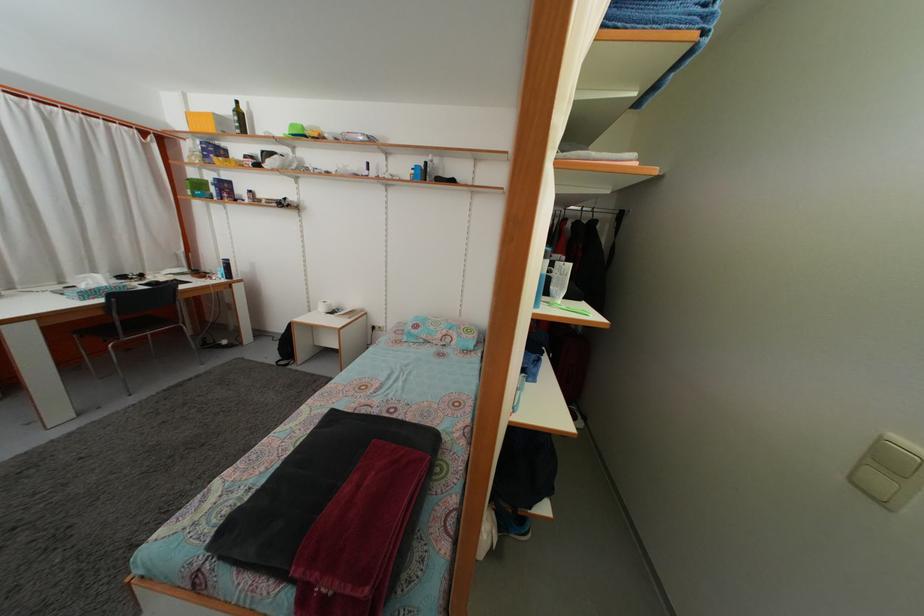
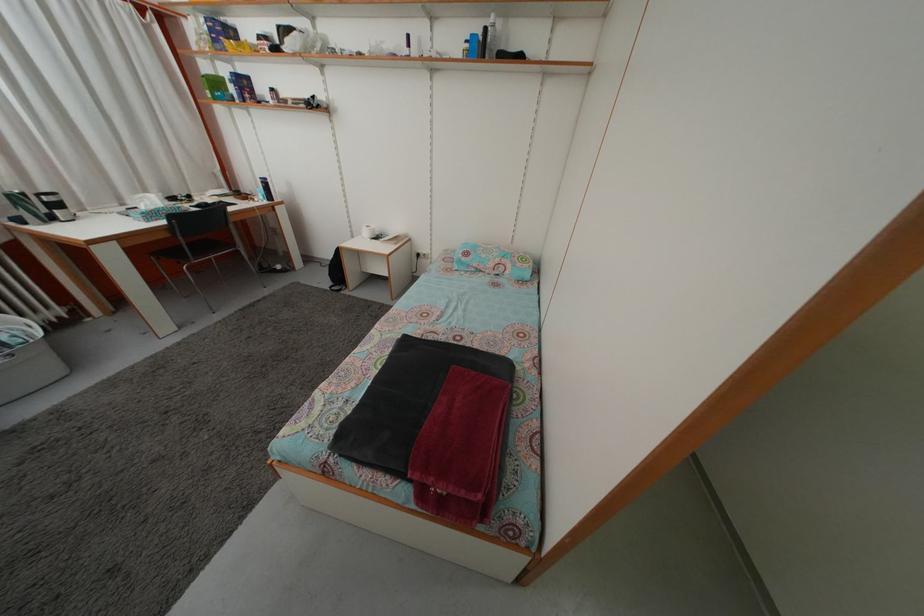
Locate, in the second image, the point that corresponds to pixel 287 336 in the first image.

(335, 262)